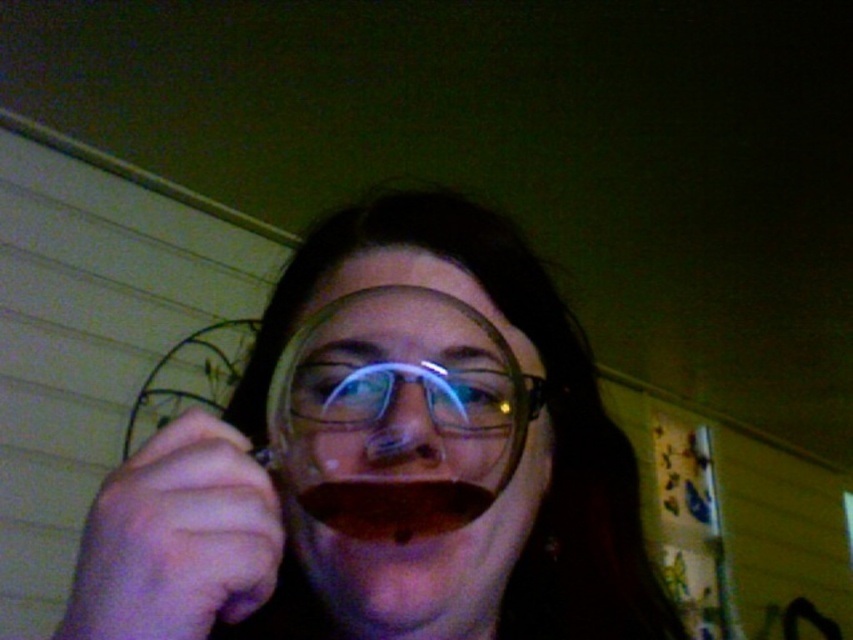
Question: Which point appears farthest from the camera in this image?

Choices:
 (A) (447, 410)
 (B) (302, 499)
 (C) (469, 445)
 (D) (293, 365)

Answer: (D)

Question: Can you confirm if transparent plastic wine glass at center is bigger than dark red liquid at mouth?

Choices:
 (A) yes
 (B) no

Answer: (A)

Question: Is matte plastic cup at center in front of dark red liquid at mouth?

Choices:
 (A) yes
 (B) no

Answer: (A)

Question: Which of the following is the closest to the observer?

Choices:
 (A) click(x=469, y=504)
 (B) click(x=474, y=544)
 (C) click(x=520, y=372)
 (D) click(x=352, y=490)

Answer: (D)

Question: Which object is positioned farthest from the dark red liquid at mouth?

Choices:
 (A) transparent plastic wine glass at center
 (B) matte plastic cup at center

Answer: (B)

Question: Is matte plastic cup at center smaller than clear plastic glasses at center?

Choices:
 (A) yes
 (B) no

Answer: (B)